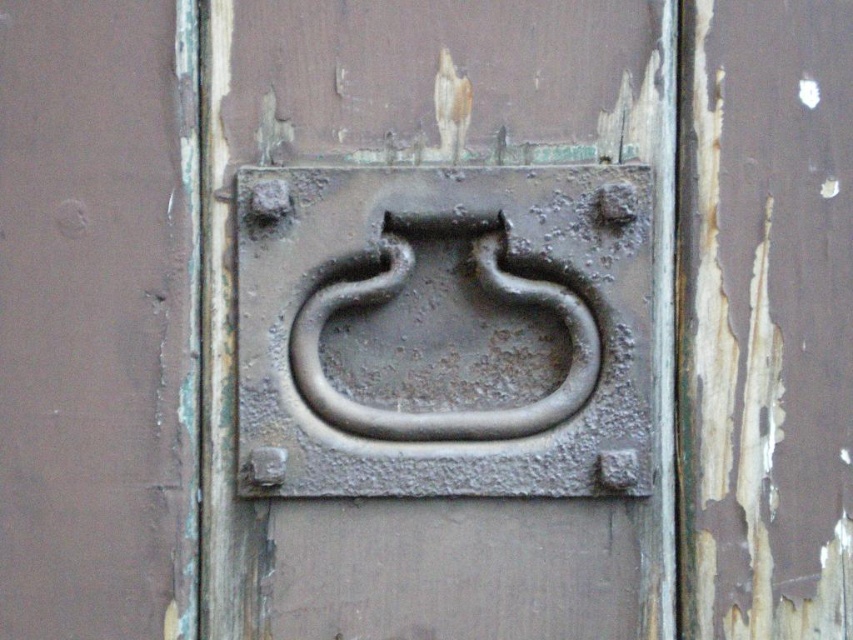
Is rusty metal handle at center closer to camera compared to rusty metal door handle at center?

That is True.

Consider the image. Is rusty metal handle at center bigger than rusty metal door handle at center?

Yes.

Locate an element on the screen. rusty metal handle at center is located at coordinates (440, 323).

This screenshot has height=640, width=853. Find the location of `rusty metal handle at center`. rusty metal handle at center is located at coordinates (440, 323).